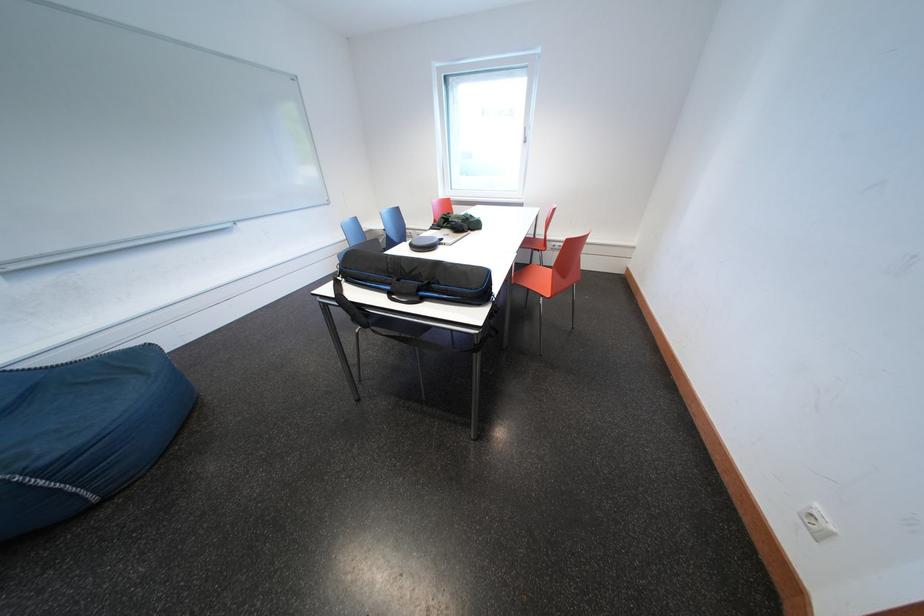
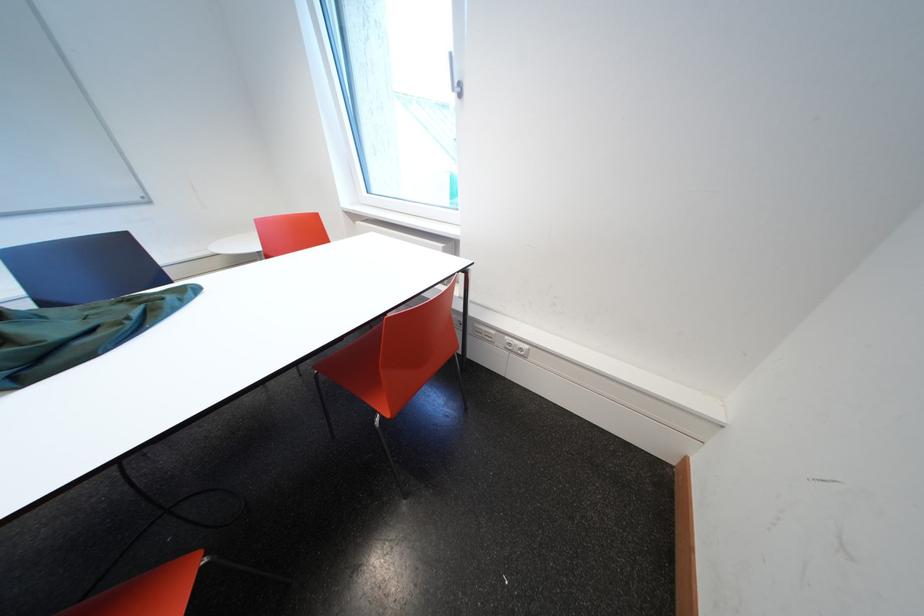
The images are taken continuously from a first-person perspective. In which direction are you moving?

The cameraman walked toward right, forward.